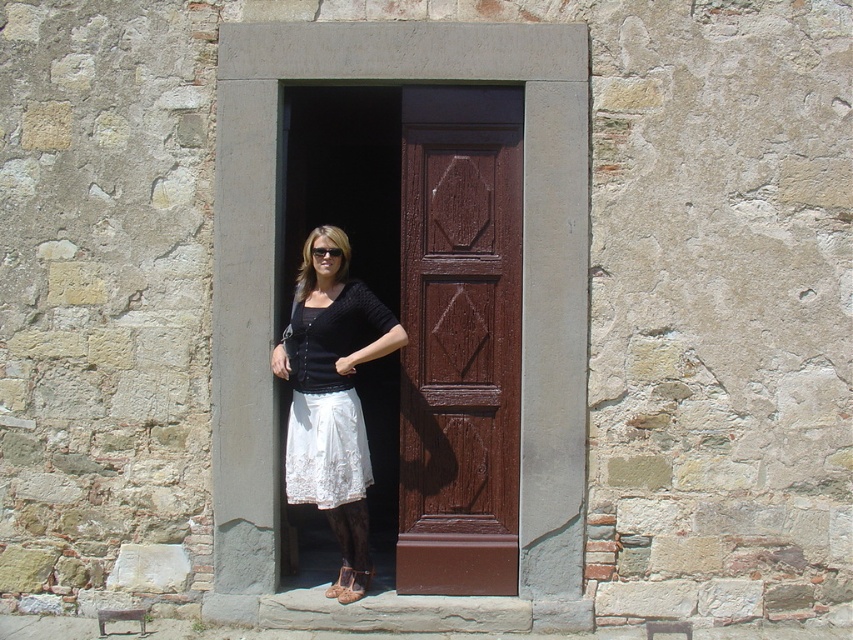
Question: Is brown wooden door at center below black plastic goggles at center?

Choices:
 (A) yes
 (B) no

Answer: (A)

Question: Can you confirm if brown wooden door at center is positioned above white lace skirt at center?

Choices:
 (A) yes
 (B) no

Answer: (A)

Question: Among these points, which one is nearest to the camera?

Choices:
 (A) (323, 246)
 (B) (347, 544)

Answer: (A)

Question: Which object is positioned farthest from the black plastic goggles at center?

Choices:
 (A) brown wooden door at center
 (B) white lace skirt at center

Answer: (A)

Question: Estimate the real-world distances between objects in this image. Which object is closer to the black plastic goggles at center?

Choices:
 (A) white lace skirt at center
 (B) brown wooden door at center

Answer: (A)

Question: In this image, where is brown wooden door at center located relative to black plastic goggles at center?

Choices:
 (A) left
 (B) right

Answer: (B)